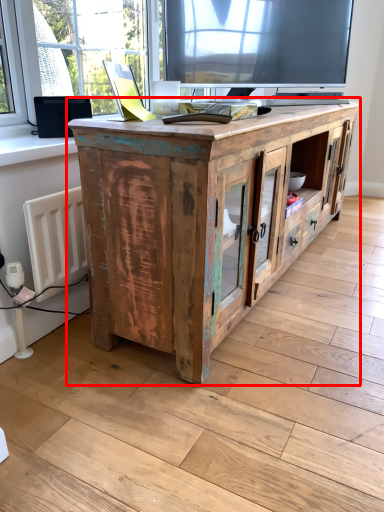
Question: From the image's perspective, where is cabinetry (annotated by the red box) located relative to window sill?

Choices:
 (A) below
 (B) above

Answer: (A)